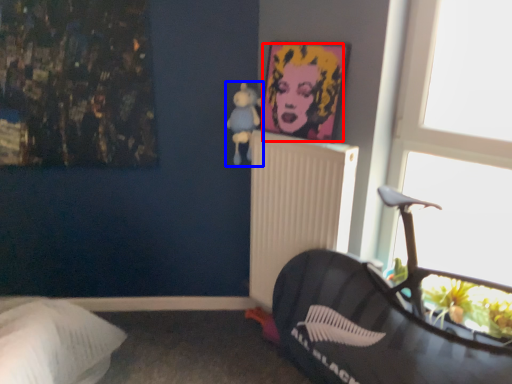
Question: Which object appears farthest to the camera in this image, person (highlighted by a red box) or toy (highlighted by a blue box)?

Choices:
 (A) person
 (B) toy

Answer: (B)